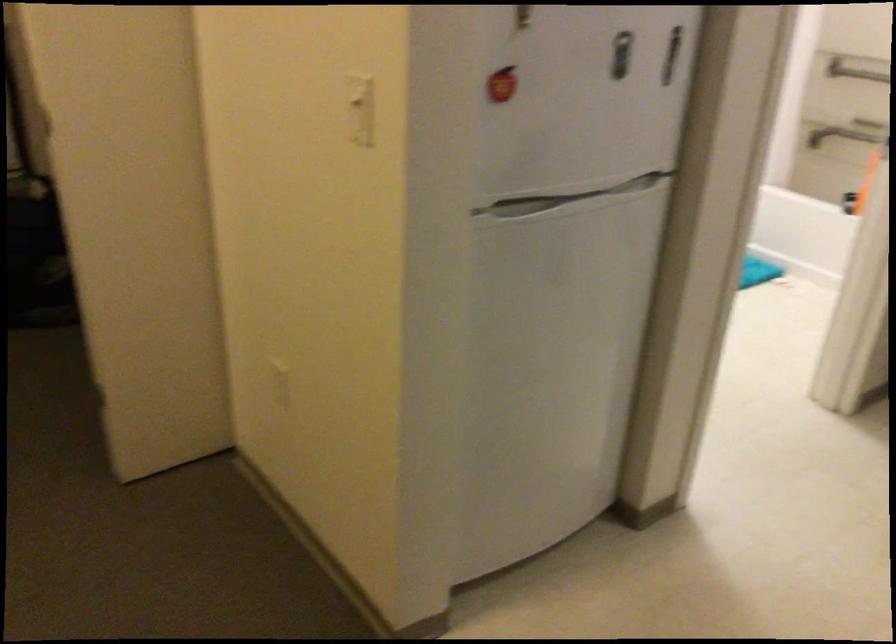
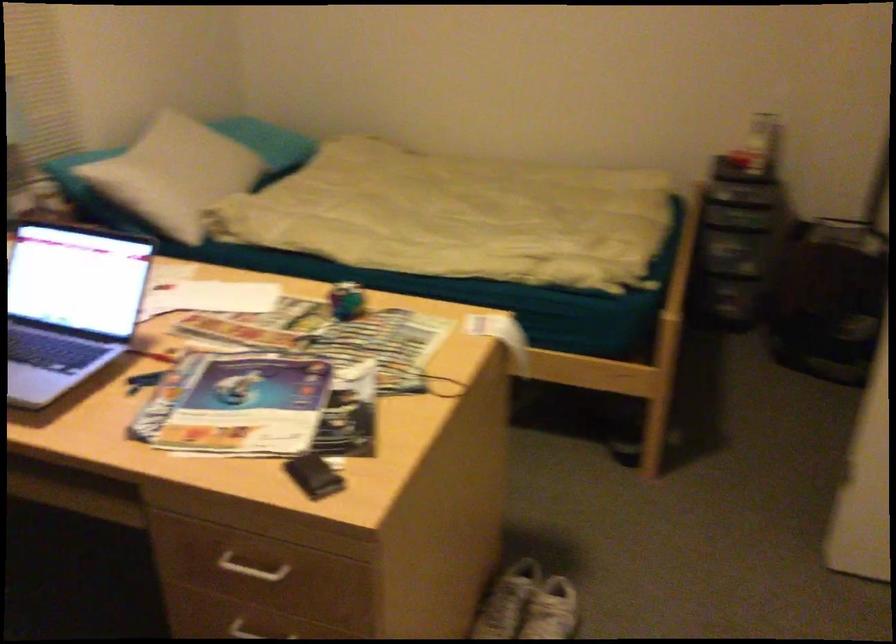
Question: How did the camera likely rotate?

Choices:
 (A) Left
 (B) Right
 (C) Up
 (D) Down

Answer: (A)